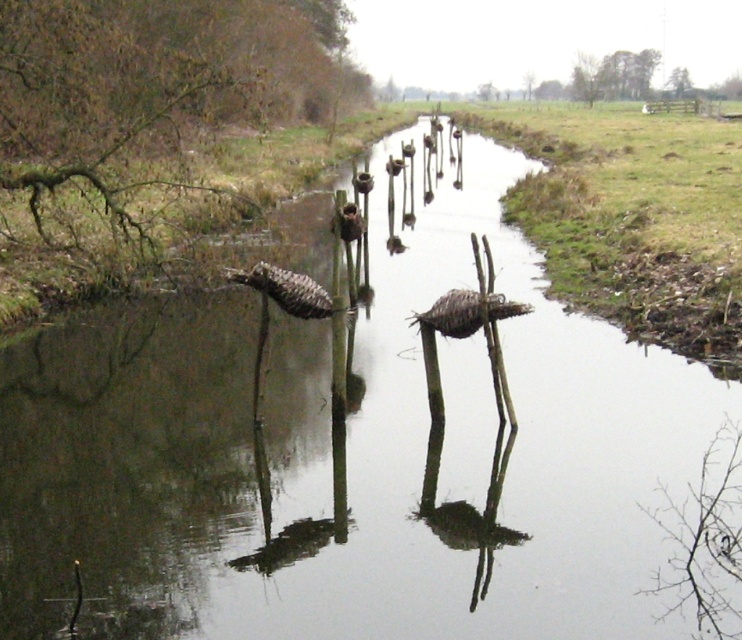
Question: Among these points, which one is nearest to the camera?

Choices:
 (A) (295, 92)
 (B) (479, 93)

Answer: (A)

Question: Does green leafy tree at upper right have a smaller size compared to green leafy tree at upper center?

Choices:
 (A) yes
 (B) no

Answer: (A)

Question: Does green leafy tree at upper right have a larger size compared to green leafy tree at upper center?

Choices:
 (A) no
 (B) yes

Answer: (A)

Question: Which object is the closest to the green leafy tree at upper right?

Choices:
 (A) green mossy tree at upper center
 (B) brown woven basket at left

Answer: (A)

Question: Can you confirm if brown woven basket at left is positioned above green leafy tree at upper right?

Choices:
 (A) yes
 (B) no

Answer: (B)

Question: Which of the following is the farthest from the observer?

Choices:
 (A) (496, 92)
 (B) (683, 80)
 (C) (131, 74)
 (D) (531, 74)

Answer: (D)